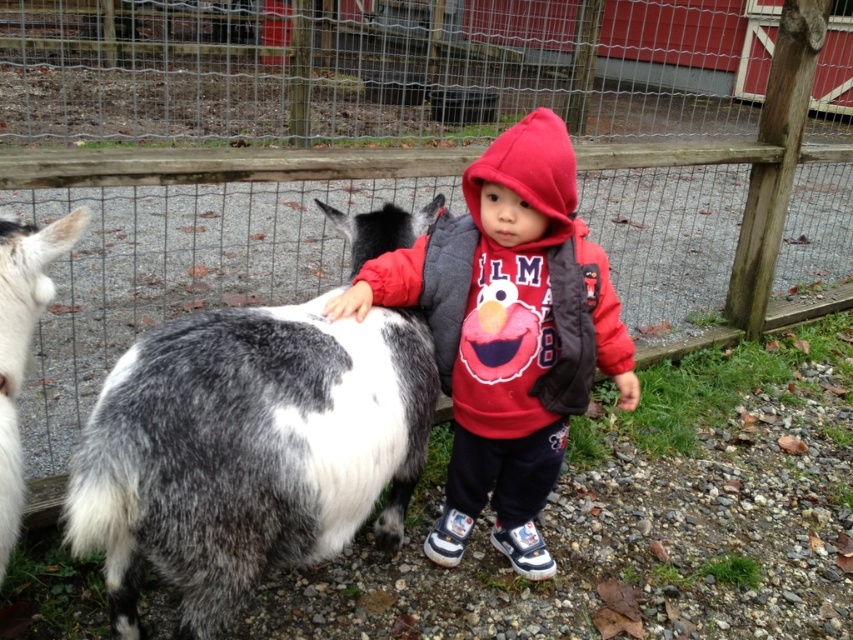
Question: Observing the image, what is the correct spatial positioning of matte red hoodie at center in reference to white and gray fur goat at left?

Choices:
 (A) above
 (B) below

Answer: (A)

Question: Where is spotted fur goat at center located in relation to white and gray fur goat at left in the image?

Choices:
 (A) left
 (B) right

Answer: (B)

Question: Considering the real-world distances, which object is farthest from the matte red hoodie at center?

Choices:
 (A) white and gray fur goat at left
 (B) spotted fur goat at center

Answer: (A)

Question: Does spotted fur goat at center come in front of white and gray fur goat at left?

Choices:
 (A) no
 (B) yes

Answer: (A)

Question: Which object is closer to the camera taking this photo?

Choices:
 (A) spotted fur goat at center
 (B) white and gray fur goat at left
 (C) matte red hoodie at center

Answer: (B)

Question: Among these points, which one is farthest from the camera?

Choices:
 (A) (117, 600)
 (B) (479, 413)
 (C) (24, 348)

Answer: (B)